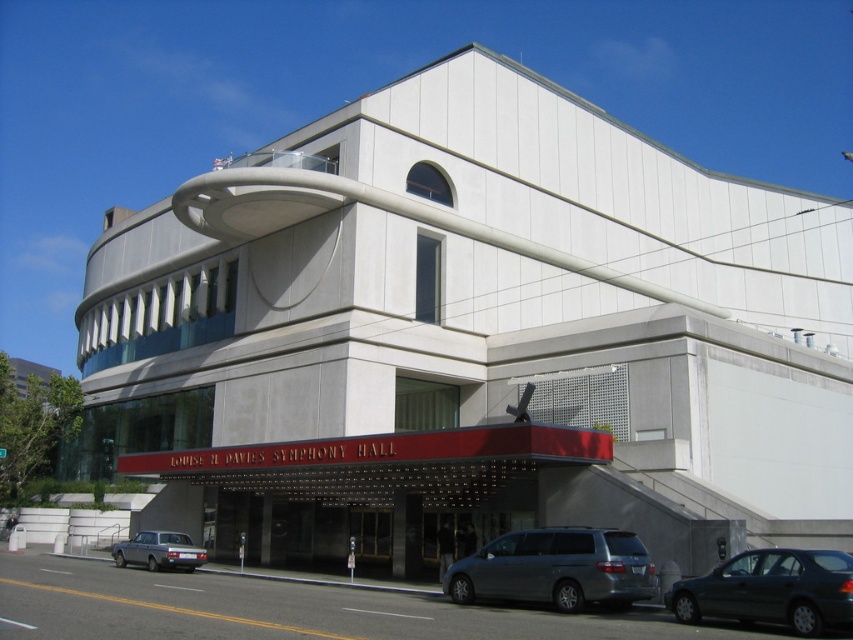
Is silver metallic minivan at lower center shorter than silver metallic station wagon at lower left?

Indeed, silver metallic minivan at lower center has a lesser height compared to silver metallic station wagon at lower left.

Who is taller, silver metallic minivan at lower center or silver metallic station wagon at lower left?

silver metallic station wagon at lower left is taller.

Where is `silver metallic minivan at lower center`? Image resolution: width=853 pixels, height=640 pixels. silver metallic minivan at lower center is located at coordinates (556, 568).

Find the location of a particular element. silver metallic minivan at lower center is located at coordinates (556, 568).

Does silver metallic minivan at lower center have a greater width compared to dark gray metallic sedan at lower right?

In fact, silver metallic minivan at lower center might be narrower than dark gray metallic sedan at lower right.

Which is behind, point (550, 582) or point (839, 614)?

The point (550, 582) is more distant.

Which is in front, point (527, 541) or point (833, 580)?

Positioned in front is point (833, 580).

The image size is (853, 640). What are the coordinates of `silver metallic minivan at lower center` in the screenshot? It's located at (556, 568).

Describe the element at coordinates (770, 589) in the screenshot. I see `dark gray metallic sedan at lower right` at that location.

Is dark gray metallic sedan at lower right to the left of silver metallic station wagon at lower left from the viewer's perspective?

In fact, dark gray metallic sedan at lower right is to the right of silver metallic station wagon at lower left.

The width and height of the screenshot is (853, 640). What do you see at coordinates (770, 589) in the screenshot? I see `dark gray metallic sedan at lower right` at bounding box center [770, 589].

Locate an element on the screen. The width and height of the screenshot is (853, 640). dark gray metallic sedan at lower right is located at coordinates (770, 589).